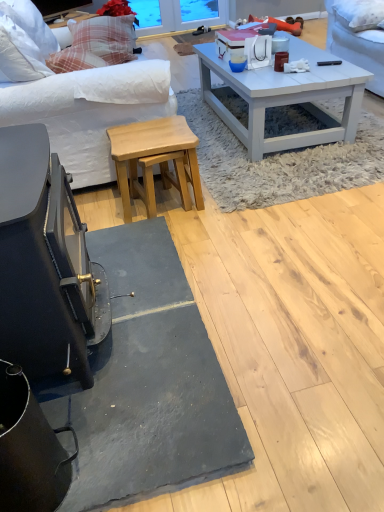
Identify the location of vacant space to the right of matte brown coffee cup at center, the 1th coffee cup viewed from the right. (311, 70).